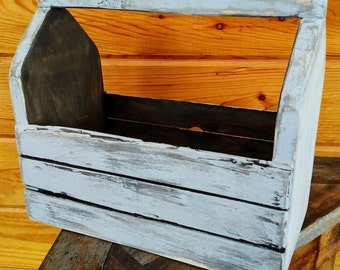
This screenshot has height=270, width=340. In order to click on table in this screenshot , I will do `click(309, 226)`.